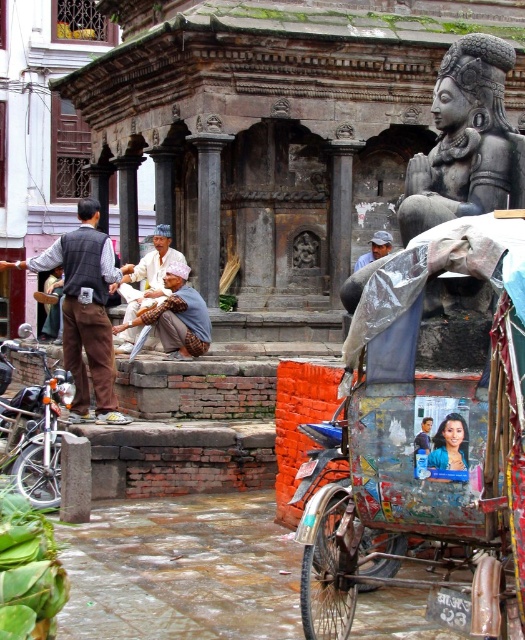
The height and width of the screenshot is (640, 525). What are the coordinates of `light brown woven fabric at center` in the screenshot? It's located at (150, 275).

Is the position of light brown woven fabric at center more distant than that of smooth skin face at center?

Yes, light brown woven fabric at center is further from the viewer.

Is point (155, 282) in front of point (460, 417)?

No, it is behind (460, 417).

Locate an element on the screen. light brown woven fabric at center is located at coordinates (150, 275).

Is the position of smooth skin face at center more distant than that of light blue fabric at center?

No, smooth skin face at center is closer to the viewer.

Image resolution: width=525 pixels, height=640 pixels. In order to click on smooth skin face at center in this screenshot , I will do `click(448, 444)`.

Between metallic painted cart at center and black stone statue at upper right, which one has less height?

black stone statue at upper right

Between metallic painted cart at center and black stone statue at upper right, which one is positioned lower?

metallic painted cart at center is lower down.

Is point (397, 492) positioned before point (498, 205)?

That is True.

You are a GUI agent. You are given a task and a screenshot of the screen. Output one action in this format:
    pyautogui.click(x=<x>, y=<y>)
    Task: Click on the metallic painted cart at center
    This screenshot has height=640, width=525.
    Given the screenshot: What is the action you would take?
    pyautogui.click(x=425, y=449)